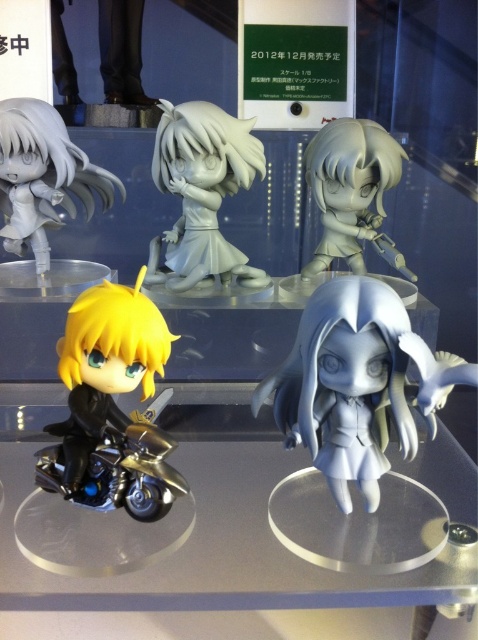
You are a photographer trying to capture the figurines in the glass case. You notice two points marked as point 1 at coordinates (327, 444) and point 2 at coordinates (350, 179). Which point is positioned closer to you?

Point 1 at coordinates (327, 444) is closer to the viewer than point 2 at coordinates (350, 179).

You are a collector examining the display case. You notice the clear acrylic glass table at lower center and the shiny metallic motorcycle at lower left. Which object is positioned lower in the scene?

The clear acrylic glass table at lower center is located below the shiny metallic motorcycle at lower left, so it is positioned lower in the scene.